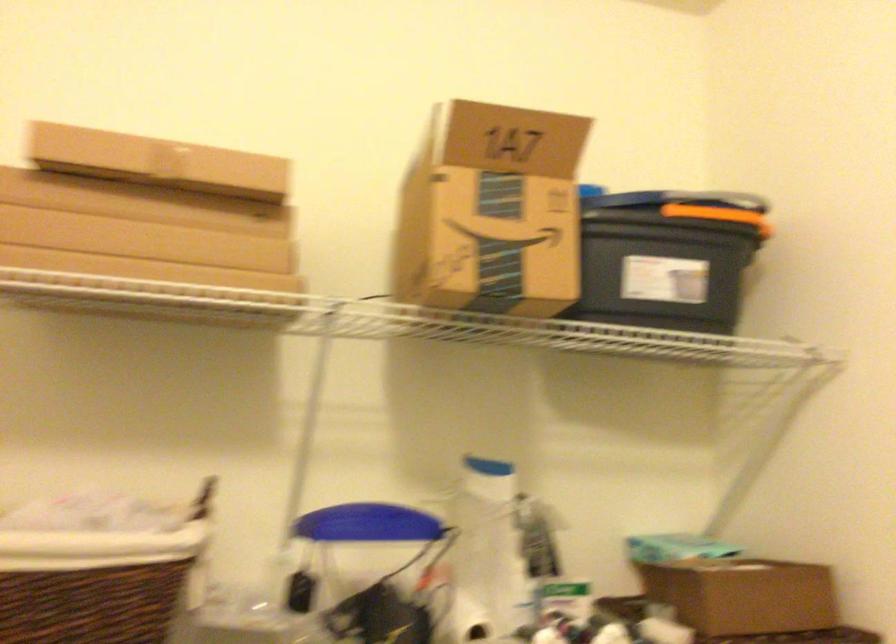
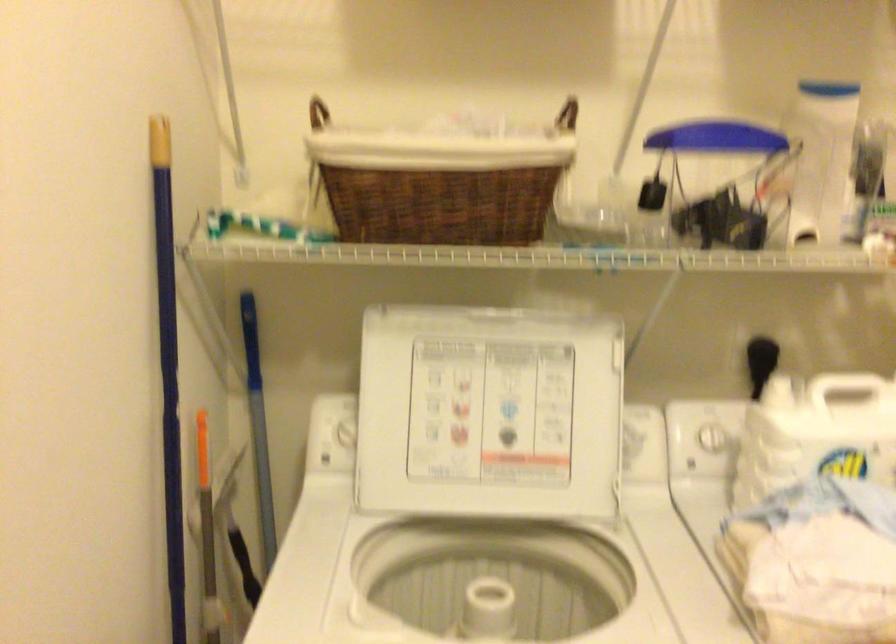
What movement of the cameraman would produce the second image?

The movement direction of the cameraman is left, backward.